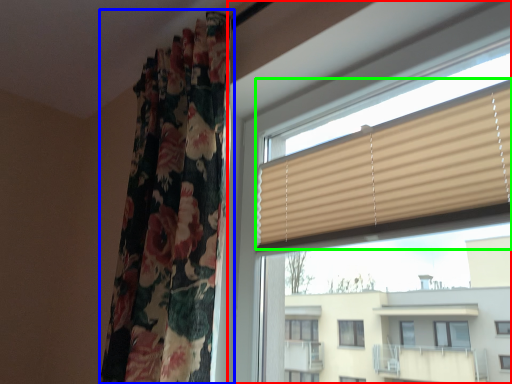
Question: Considering the real-world distances, which object is farthest from window (highlighted by a red box)? curtain (highlighted by a blue box) or window blind (highlighted by a green box)?

Choices:
 (A) curtain
 (B) window blind

Answer: (A)